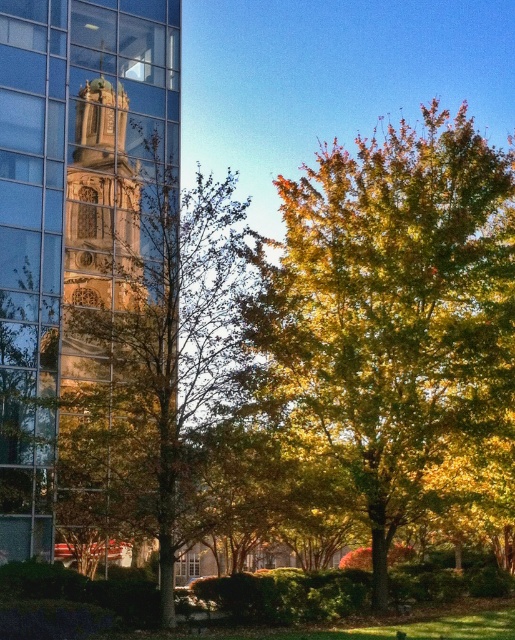
Question: Among these objects, which one is farthest from the camera?

Choices:
 (A) green leafy tree at center
 (B) golden glass tower at left

Answer: (B)

Question: Can you confirm if golden-green leafy tree at center-right is smaller than green leafy tree at center?

Choices:
 (A) yes
 (B) no

Answer: (B)

Question: Is golden-green leafy tree at center-right closer to the viewer compared to green leafy tree at center?

Choices:
 (A) yes
 (B) no

Answer: (B)

Question: Which point is farther to the camera?

Choices:
 (A) green leafy tree at center
 (B) golden-green leafy tree at center-right
 (C) golden glass tower at left

Answer: (B)

Question: Which point is closer to the camera?

Choices:
 (A) green leafy tree at center
 (B) golden glass tower at left

Answer: (A)

Question: Does golden-green leafy tree at center-right have a smaller size compared to golden glass tower at left?

Choices:
 (A) no
 (B) yes

Answer: (A)